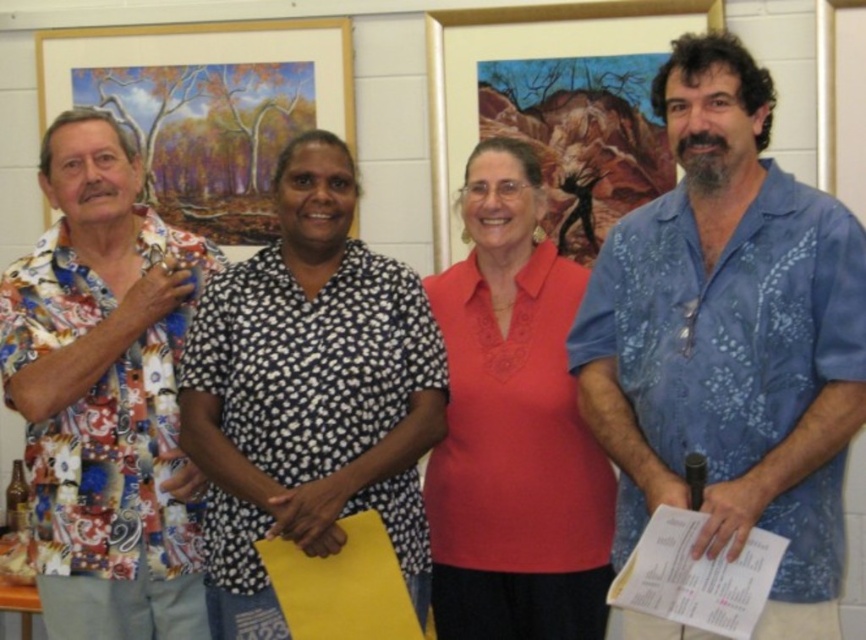
You are at a party and want to hand a drink to the tallest person between the blue floral shirt at center and the black dotted shirt at center. Which one should you approach?

The blue floral shirt at center is taller than the black dotted shirt at center, so you should approach the blue floral shirt at center to hand the drink.

You are a photographer standing at the far right of the image. You need to adjust the camera to include both the blue floral shirt at center and the man on the far left in the frame. What is the minimum distance you should set the camera focus length to capture both subjects?

The minimum focus length should be set to at least 5.44 feet to ensure both the blue floral shirt at center and the man on the far left are in the frame.

From the picture: You are a photographer trying to capture a group photo. The group includes a person wearing a black dotted shirt at center and another in a printed cotton shirt at left. You need to ensure there is at least 12 inches between them for proper framing. Based on the scene, will this spacing requirement be met?

The distance between the black dotted shirt at center and the printed cotton shirt at left is 12.97 inches, which exceeds the required 12 inches. Therefore, the spacing requirement is met.